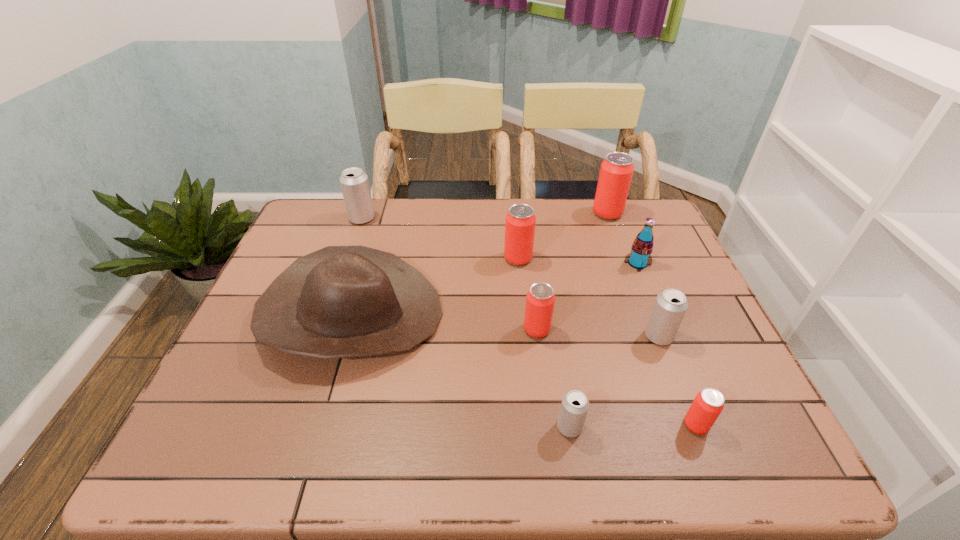
The height and width of the screenshot is (540, 960). Identify the location of the second closest white beer can relative to the second biggest red beer can. (354, 183).

This screenshot has height=540, width=960. Identify the location of free spot that satisfies the following two spatial constraints: 1. on the front side of the cowboy hat; 2. on the left side of the second smallest red beer can. (347, 330).

I want to click on free space that satisfies the following two spatial constraints: 1. on the back side of the farthest red beer can; 2. on the right side of the third farthest red beer can, so click(522, 214).

In order to click on free spot that satisfies the following two spatial constraints: 1. on the front side of the leftmost white beer can; 2. on the left side of the second farthest red beer can in this screenshot , I will do `click(348, 259)`.